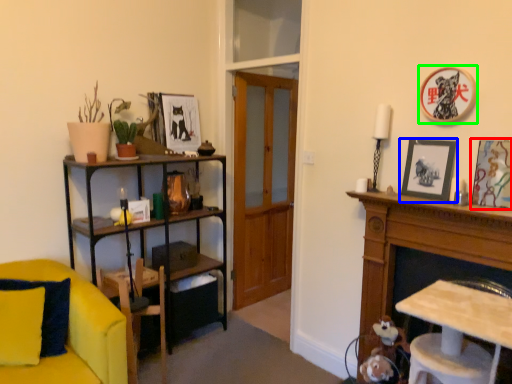
Question: Based on their relative distances, which object is farther from picture frame (highlighted by a red box)? Choose from picture frame (highlighted by a blue box) and picture frame (highlighted by a green box).

Choices:
 (A) picture frame
 (B) picture frame

Answer: (B)